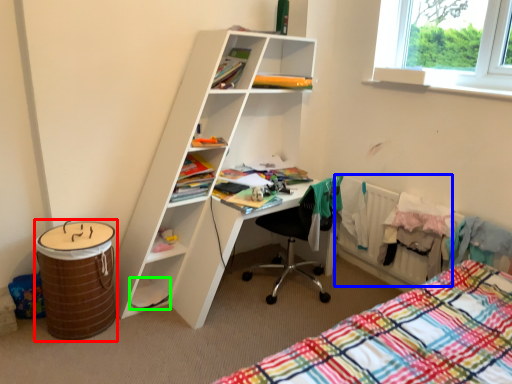
Question: Which is nearer to the barrel (highlighted by a red box)? radiator (highlighted by a blue box) or book (highlighted by a green box).

Choices:
 (A) radiator
 (B) book

Answer: (B)